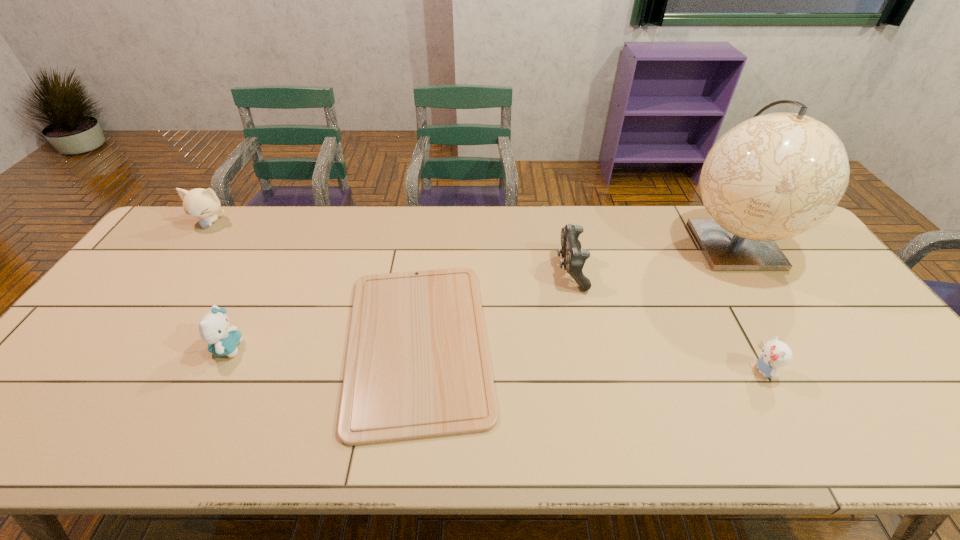
The height and width of the screenshot is (540, 960). I want to click on blank space at the right edge of the desktop, so click(x=821, y=264).

Identify the location of vacant area at the far left corner of the desktop. (191, 248).

Where is `free spot between the control and the chopping board`? The image size is (960, 540). free spot between the control and the chopping board is located at coordinates (494, 306).

At what (x,y) coordinates should I click in order to perform the action: click on free space between the leftmost object and the third object from right to left. Please return your answer as a coordinate pair (x, y). The width and height of the screenshot is (960, 540). Looking at the image, I should click on (391, 246).

Image resolution: width=960 pixels, height=540 pixels. I want to click on vacant area that lies between the third object from left to right and the second object from left to right, so click(323, 345).

Find the location of a particular element. The width and height of the screenshot is (960, 540). free spot between the rightmost kitten and the leftmost kitten is located at coordinates (487, 296).

You are a GUI agent. You are given a task and a screenshot of the screen. Output one action in this format:
    pyautogui.click(x=<x>, y=<y>)
    Task: Click on the free area in between the control and the leftmost object
    This screenshot has height=540, width=960.
    Given the screenshot: What is the action you would take?
    pyautogui.click(x=391, y=246)

Where is `unoccupied position between the rightmost kitten and the second kitten from left to right`? unoccupied position between the rightmost kitten and the second kitten from left to right is located at coordinates (495, 359).

Find the location of a particular element. The height and width of the screenshot is (540, 960). free area in between the farthest kitten and the second object from left to right is located at coordinates (219, 285).

Image resolution: width=960 pixels, height=540 pixels. In order to click on vacant area between the second object from left to right and the shortest object in this screenshot , I will do `click(323, 345)`.